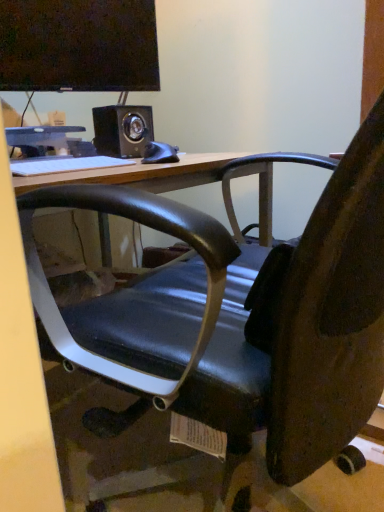
Question: Is white matte keyboard at upper center located within black matte mouse at center?

Choices:
 (A) yes
 (B) no

Answer: (B)

Question: From a real-world perspective, is black matte mouse at center physically below white matte keyboard at upper center?

Choices:
 (A) yes
 (B) no

Answer: (B)

Question: Considering the relative sizes of black matte mouse at center and white matte keyboard at upper center in the image provided, is black matte mouse at center smaller than white matte keyboard at upper center?

Choices:
 (A) no
 (B) yes

Answer: (B)

Question: Is black matte mouse at center outside of white matte keyboard at upper center?

Choices:
 (A) no
 (B) yes

Answer: (B)

Question: Can you confirm if black matte mouse at center is positioned to the right of white matte keyboard at upper center?

Choices:
 (A) no
 (B) yes

Answer: (B)

Question: Considering the positions of black matte speaker at upper center and matte black monitor at upper left in the image, is black matte speaker at upper center wider or thinner than matte black monitor at upper left?

Choices:
 (A) thin
 (B) wide

Answer: (B)

Question: From the image's perspective, is black matte speaker at upper center positioned above or below matte black monitor at upper left?

Choices:
 (A) above
 (B) below

Answer: (B)

Question: In the image, is black matte speaker at upper center positioned in front of or behind matte black monitor at upper left?

Choices:
 (A) behind
 (B) front

Answer: (A)

Question: Based on their sizes in the image, would you say black matte speaker at upper center is bigger or smaller than matte black monitor at upper left?

Choices:
 (A) small
 (B) big

Answer: (A)

Question: Based on their sizes in the image, would you say black matte speaker at upper center is bigger or smaller than white matte keyboard at upper center?

Choices:
 (A) big
 (B) small

Answer: (A)

Question: From the image's perspective, relative to white matte keyboard at upper center, is black matte speaker at upper center above or below?

Choices:
 (A) above
 (B) below

Answer: (A)

Question: From a real-world perspective, is black matte speaker at upper center above or below white matte keyboard at upper center?

Choices:
 (A) below
 (B) above

Answer: (B)

Question: Visually, is black matte speaker at upper center positioned to the left or to the right of white matte keyboard at upper center?

Choices:
 (A) left
 (B) right

Answer: (B)

Question: From a real-world perspective, is matte black monitor at upper left positioned above or below white glossy computer at upper left?

Choices:
 (A) above
 (B) below

Answer: (A)

Question: Is matte black monitor at upper left bigger or smaller than white glossy computer at upper left?

Choices:
 (A) big
 (B) small

Answer: (B)